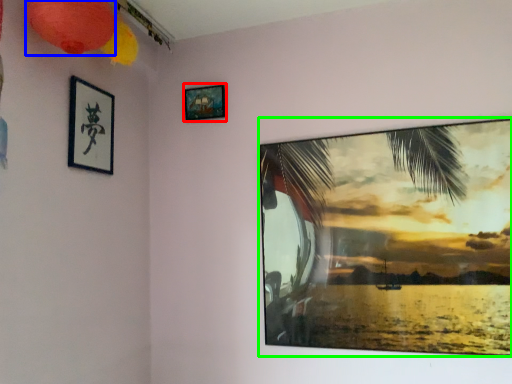
Question: Which object is the closest to the picture frame (highlighted by a red box)? Choose among these: lantern (highlighted by a blue box) or picture frame (highlighted by a green box).

Choices:
 (A) lantern
 (B) picture frame

Answer: (A)